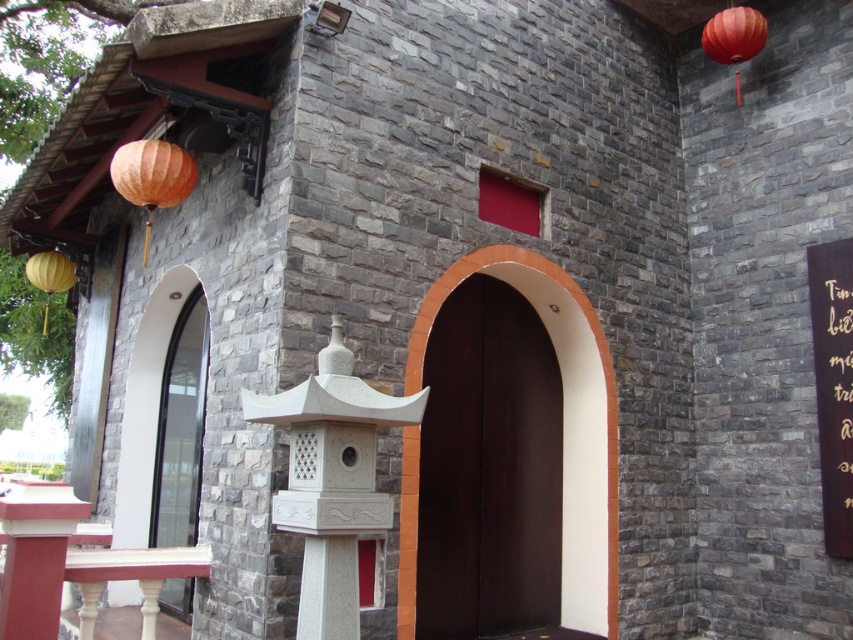
Based on the photo, is dark wood door at center further to camera compared to matte yellow lantern at left?

No, dark wood door at center is closer to the viewer.

Between dark wood door at center and matte yellow lantern at left, which one is positioned higher?

matte yellow lantern at left

Locate an element on the screen. The width and height of the screenshot is (853, 640). dark wood door at center is located at coordinates 596,358.

Who is lower down, dark wood door at center or black wood sign at upper right?

dark wood door at center is lower down.

Consider the image. Does dark wood door at center have a larger size compared to black wood sign at upper right?

Yes.

Is point (613, 598) positioned in front of point (825, 499)?

Yes, it is in front of point (825, 499).

Locate an element on the screen. dark wood door at center is located at coordinates (596, 358).

Does white stone lantern at center appear under dark wood door at center?

Incorrect, white stone lantern at center is not positioned below dark wood door at center.

Which is more to the right, white stone lantern at center or dark wood door at center?

dark wood door at center is more to the right.

This screenshot has height=640, width=853. I want to click on white stone lantern at center, so click(331, 480).